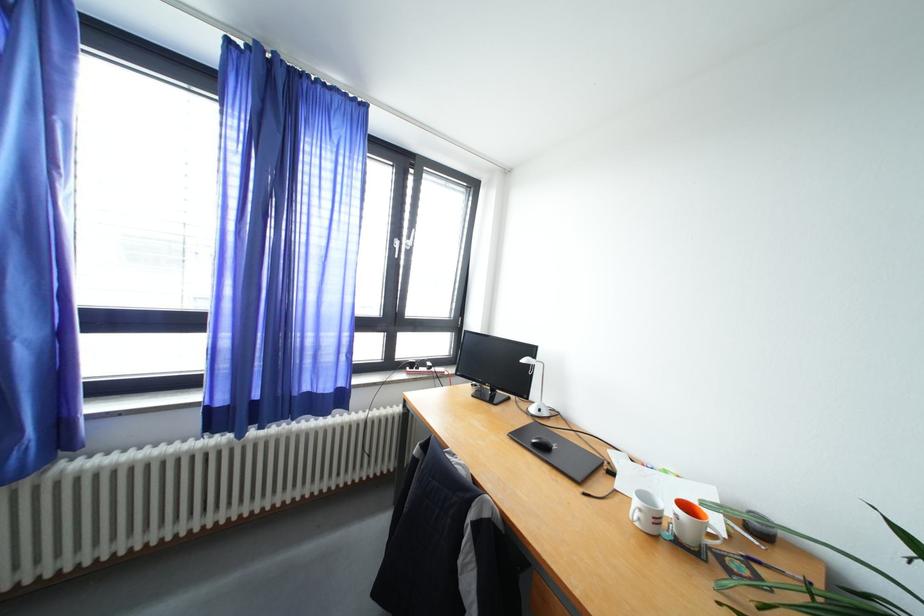
What do you see at coordinates (404, 243) in the screenshot? I see `the white window handle` at bounding box center [404, 243].